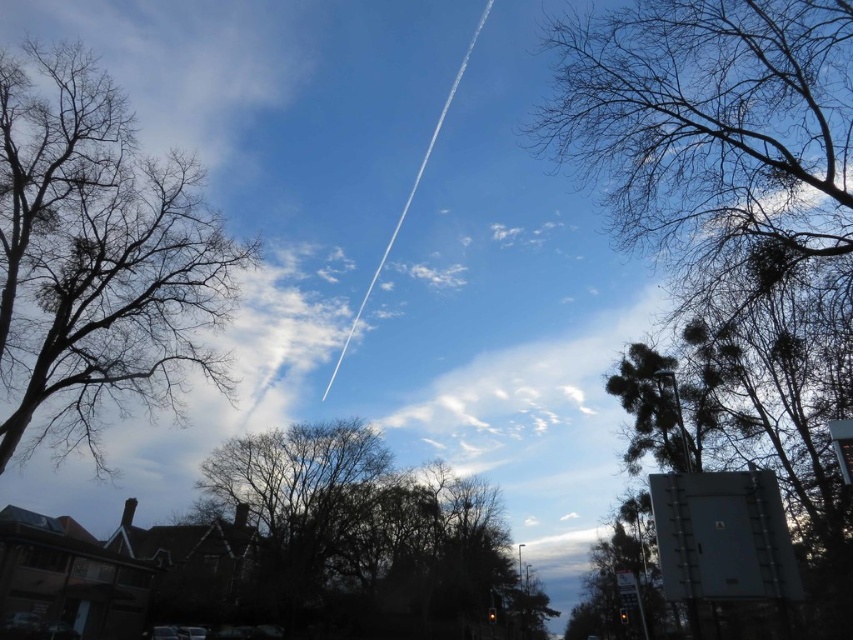
You are standing at the base of the pole with the utility box on the right. Looking up towards the sky, you notice a point marked at coordinates (97,259). What object is located at this point?

The point at coordinates (97,259) is occupied by bare branches at upper left.